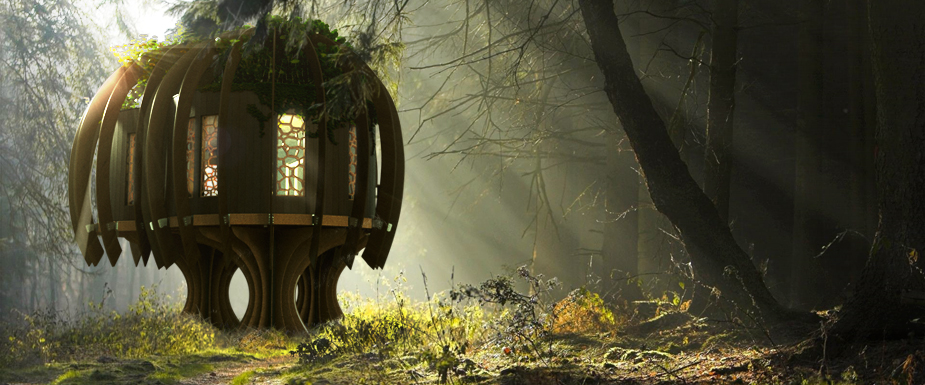
Find the location of a particular element. windows is located at coordinates (290, 167), (207, 159), (194, 162), (354, 157), (133, 159).